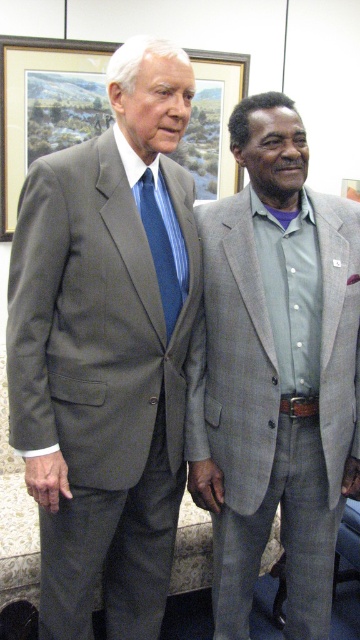
You are a photographer adjusting your camera settings. You notice the brushed metal picture frame at upper center and the blue striped tie at center in your viewfinder. Which object is positioned to the left in the image?

The brushed metal picture frame at upper center is positioned to the left of the blue striped tie at center.

You are a photographer adjusting the lighting for a portrait. You notice the brushed metal picture frame at upper center and the blue striped tie at center. Which object requires a wider light diffuser to accommodate its size?

The brushed metal picture frame at upper center requires a wider light diffuser because its width surpasses that of the blue striped tie at center.

You are standing in the room where the two men are positioned. You want to place a small decorative item exactly at the point marked as point (312, 332). If your arm reaches out 4 feet, can you comfortably place the item there without moving your feet?

The distance of point (312, 332) from the camera is 4.71 feet, which is slightly beyond your 4 feet reach. You may need to take a step forward or adjust your position to place the item comfortably.